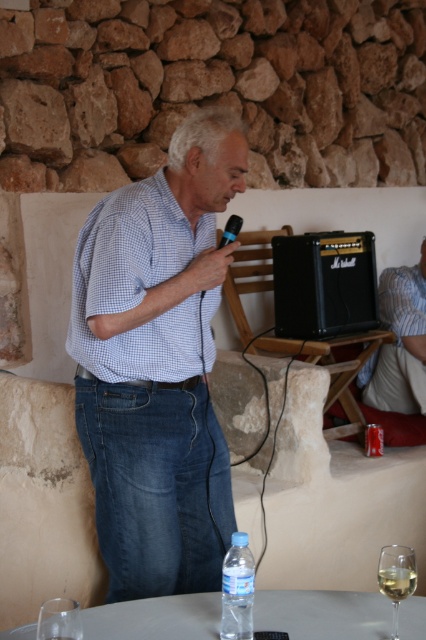
Question: Does denim jeans at lower center appear on the left side of transparent glass at lower left?

Choices:
 (A) no
 (B) yes

Answer: (A)

Question: Which is nearer to the blue checkered shirt at upper center?

Choices:
 (A) black matte amplifier at right
 (B) blue checkered shirt at center
 (C) wooden table at center
 (D) clear glass wine glass at lower right

Answer: (C)

Question: Can you confirm if blue checkered shirt at center is wider than clear plastic bottle at lower center?

Choices:
 (A) no
 (B) yes

Answer: (B)

Question: Where is wooden table at center located in relation to clear glass at lower right in the image?

Choices:
 (A) right
 (B) left

Answer: (A)

Question: Based on their relative distances, which object is nearer to the white glossy round table at lower center?

Choices:
 (A) clear glass wine glass at lower right
 (B) denim jeans at lower center
 (C) black matte amplifier at right
 (D) clear plastic bottle at lower center

Answer: (D)

Question: Estimate the real-world distances between objects in this image. Which object is farther from the denim jeans at lower center?

Choices:
 (A) white glossy round table at lower center
 (B) clear glass wine at lower center

Answer: (B)